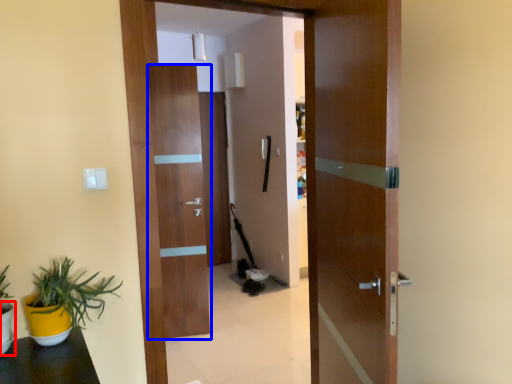
Question: Which object is further to the camera taking this photo, flowerpot (highlighted by a red box) or door (highlighted by a blue box)?

Choices:
 (A) flowerpot
 (B) door

Answer: (B)